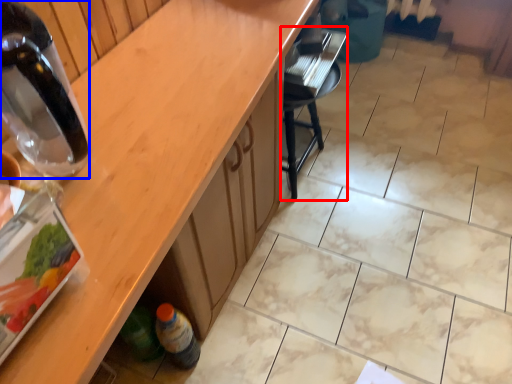
Question: Among these objects, which one is nearest to the camera, chair (highlighted by a red box) or bottle (highlighted by a blue box)?

Choices:
 (A) chair
 (B) bottle

Answer: (B)